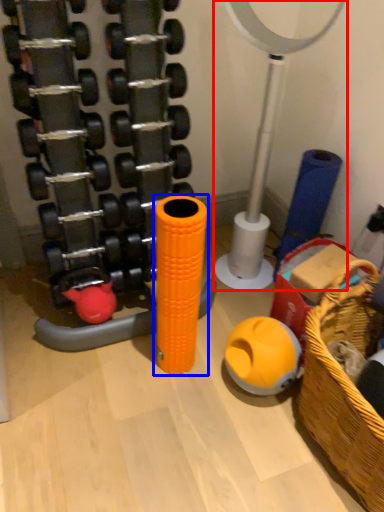
Question: Which object appears closest to the camera in this image, basketball hoop (highlighted by a red box) or toy (highlighted by a blue box)?

Choices:
 (A) basketball hoop
 (B) toy

Answer: (A)